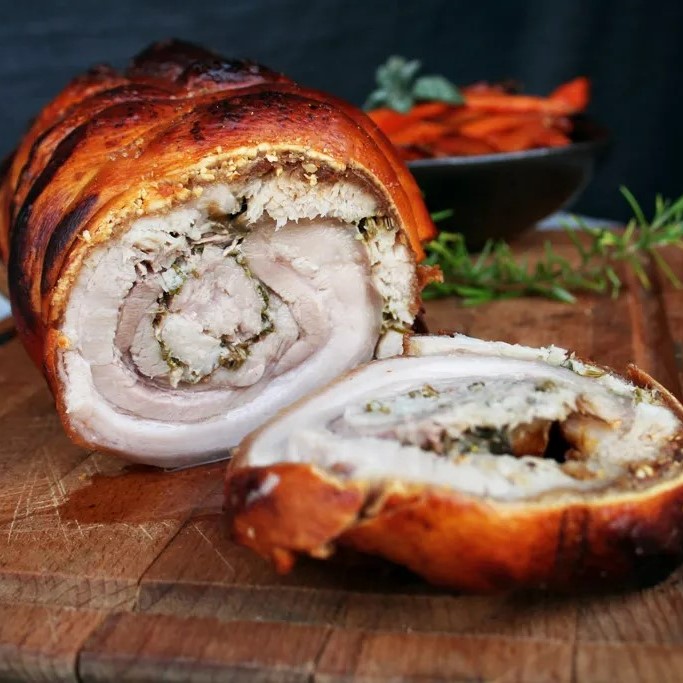
This screenshot has height=683, width=683. I want to click on black bowl, so click(537, 186).